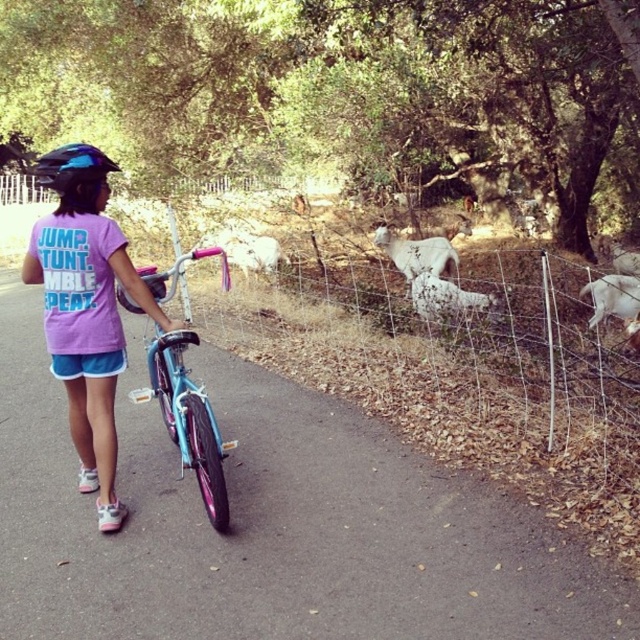
Who is taller, pink fabric shirt at center or light blue matte bicycle at center?

Standing taller between the two is pink fabric shirt at center.

At what (x,y) coordinates should I click in order to perform the action: click on pink fabric shirt at center. Please return your answer as a coordinate pair (x, y). Looking at the image, I should click on (86, 308).

Is point (104, 170) positioned behind point (122, 288)?

No, it is not.

Find the location of a particular element. The image size is (640, 640). pink fabric shirt at center is located at coordinates (86, 308).

Is white woolen sheep at center shorter than white woolly sheep at center?

Yes, white woolen sheep at center is shorter than white woolly sheep at center.

Is white woolen sheep at center smaller than white woolly sheep at center?

Correct, white woolen sheep at center occupies less space than white woolly sheep at center.

Locate an element on the screen. white woolen sheep at center is located at coordinates (449, 300).

Locate an element on the screen. white woolen sheep at center is located at coordinates (449, 300).

Is light blue matte bicycle at center further to the viewer compared to white woolen sheep at center?

No, light blue matte bicycle at center is closer to the viewer.

Between point (131, 390) and point (420, 310), which one is positioned in front?

Positioned in front is point (131, 390).

Does point (216, 461) come behind point (417, 316)?

No, (216, 461) is closer to viewer.

Identify the location of light blue matte bicycle at center. (188, 419).